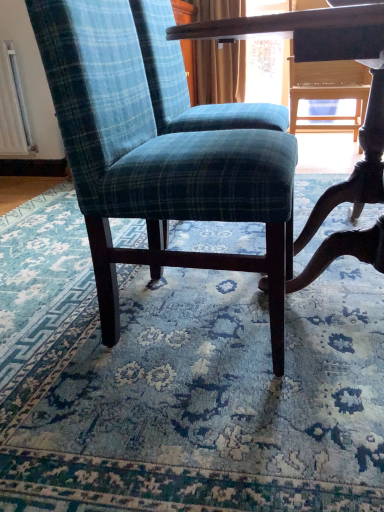
Question: From a real-world perspective, is blue plaid fabric chair at center on teal plaid fabric chair at center?

Choices:
 (A) yes
 (B) no

Answer: (B)

Question: From the image's perspective, would you say blue plaid fabric chair at center is positioned over teal plaid fabric chair at center?

Choices:
 (A) no
 (B) yes

Answer: (A)

Question: Is blue plaid fabric chair at center in contact with teal plaid fabric chair at center?

Choices:
 (A) yes
 (B) no

Answer: (B)

Question: Is teal plaid fabric chair at center a part of blue plaid fabric chair at center?

Choices:
 (A) no
 (B) yes

Answer: (A)

Question: From the image's perspective, is blue plaid fabric chair at center below teal plaid fabric chair at center?

Choices:
 (A) no
 (B) yes

Answer: (B)

Question: Is blue plaid fabric chair at center further to camera compared to teal plaid fabric chair at center?

Choices:
 (A) yes
 (B) no

Answer: (B)

Question: From the image's perspective, is teal plaid fabric chair at center on top of blue plaid fabric chair at center?

Choices:
 (A) yes
 (B) no

Answer: (A)

Question: Is teal plaid fabric chair at center positioned with its back to blue plaid fabric chair at center?

Choices:
 (A) no
 (B) yes

Answer: (A)

Question: Can you confirm if teal plaid fabric chair at center is shorter than blue plaid fabric chair at center?

Choices:
 (A) yes
 (B) no

Answer: (B)

Question: Is teal plaid fabric chair at center to the left of blue plaid fabric chair at center from the viewer's perspective?

Choices:
 (A) yes
 (B) no

Answer: (B)

Question: From the image's perspective, would you say teal plaid fabric chair at center is shown under blue plaid fabric chair at center?

Choices:
 (A) yes
 (B) no

Answer: (B)

Question: From a real-world perspective, is teal plaid fabric chair at center over blue plaid fabric chair at center?

Choices:
 (A) yes
 (B) no

Answer: (A)

Question: Is point (130, 46) positioned closer to the camera than point (326, 473)?

Choices:
 (A) closer
 (B) farther

Answer: (B)